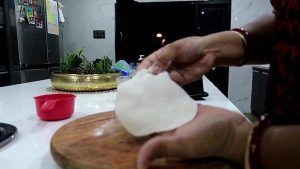
What are the coordinates of `front of lower cabinets and drawers` in the screenshot? It's located at (261, 86).